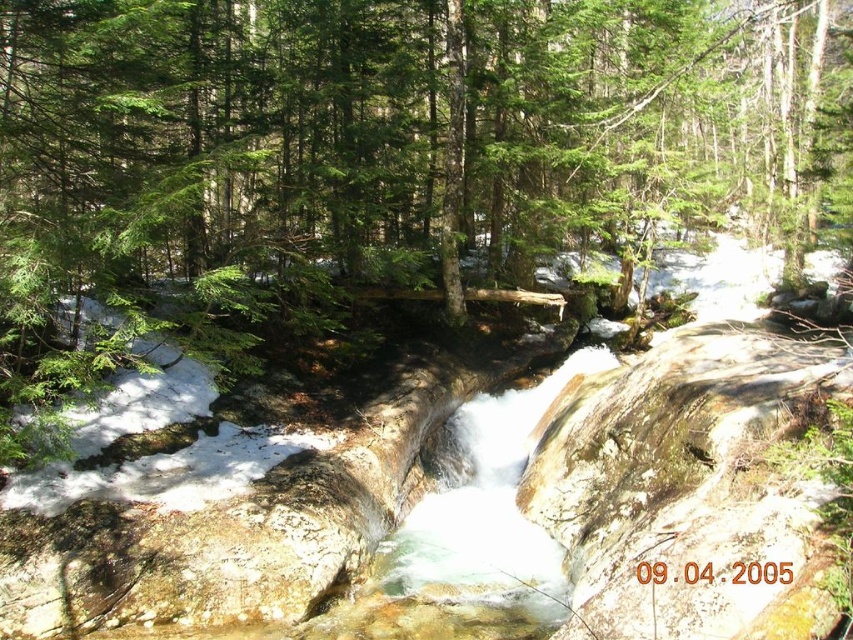
Question: Considering the relative positions of green matte tree at center and clear water at center in the image provided, where is green matte tree at center located with respect to clear water at center?

Choices:
 (A) right
 (B) left

Answer: (A)

Question: Which point is closer to the camera?

Choices:
 (A) (766, 202)
 (B) (421, 538)

Answer: (B)

Question: Which object is farther from the camera taking this photo?

Choices:
 (A) green matte tree at center
 (B) clear water at center

Answer: (B)

Question: Is green matte tree at center above clear water at center?

Choices:
 (A) yes
 (B) no

Answer: (A)

Question: Which point is closer to the camera taking this photo?

Choices:
 (A) [526, 600]
 (B) [439, 81]

Answer: (A)

Question: Does green matte tree at center have a smaller size compared to clear water at center?

Choices:
 (A) no
 (B) yes

Answer: (A)